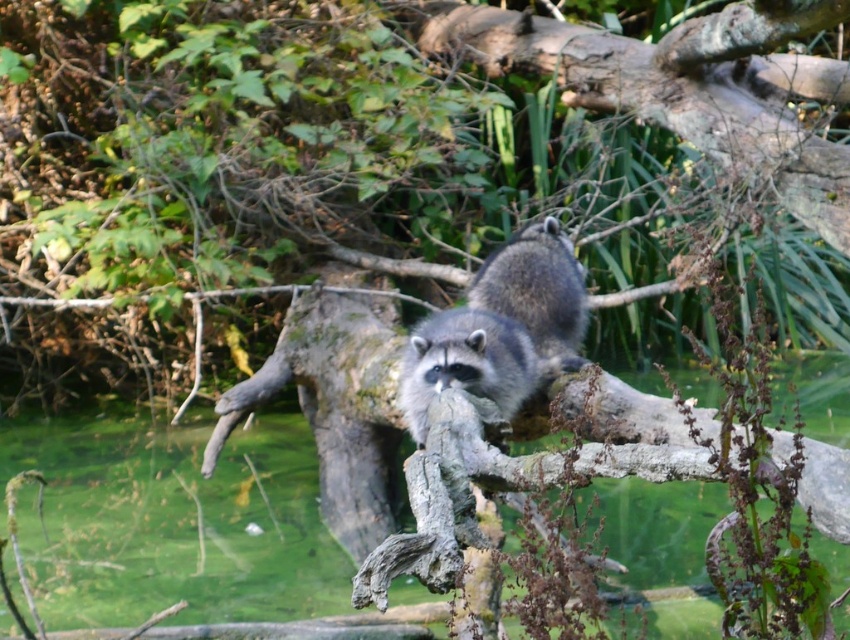
Question: Can you confirm if fuzzy gray raccoon at center is thinner than fuzzy gray raccoon at upper center?

Choices:
 (A) yes
 (B) no

Answer: (B)

Question: Which point is farther from the camera taking this photo?

Choices:
 (A) (479, 326)
 (B) (500, 268)

Answer: (B)

Question: Is fuzzy gray raccoon at center in front of fuzzy gray raccoon at upper center?

Choices:
 (A) no
 (B) yes

Answer: (B)

Question: Which point is closer to the camera?

Choices:
 (A) (514, 269)
 (B) (525, 365)

Answer: (B)

Question: Does fuzzy gray raccoon at center have a lesser width compared to fuzzy gray raccoon at upper center?

Choices:
 (A) yes
 (B) no

Answer: (B)